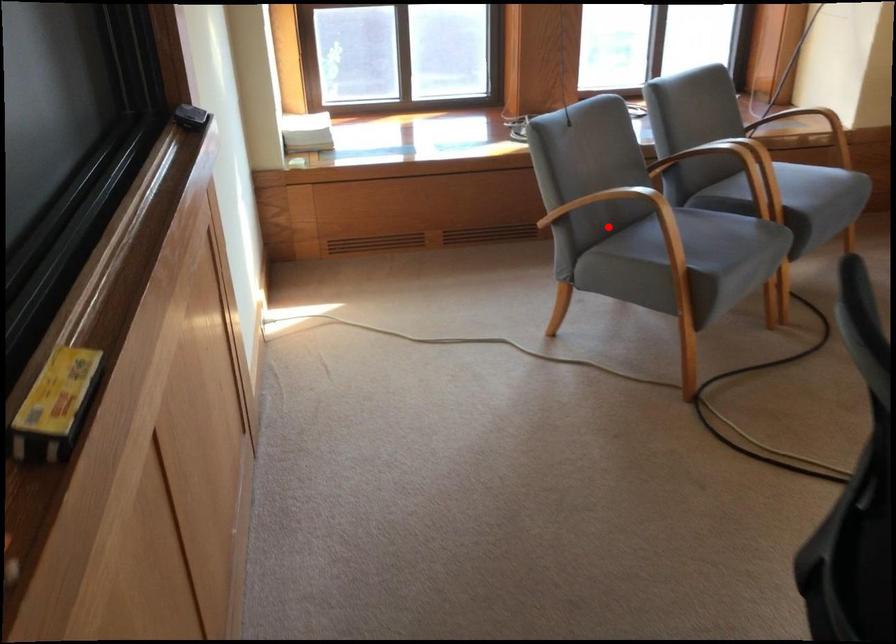
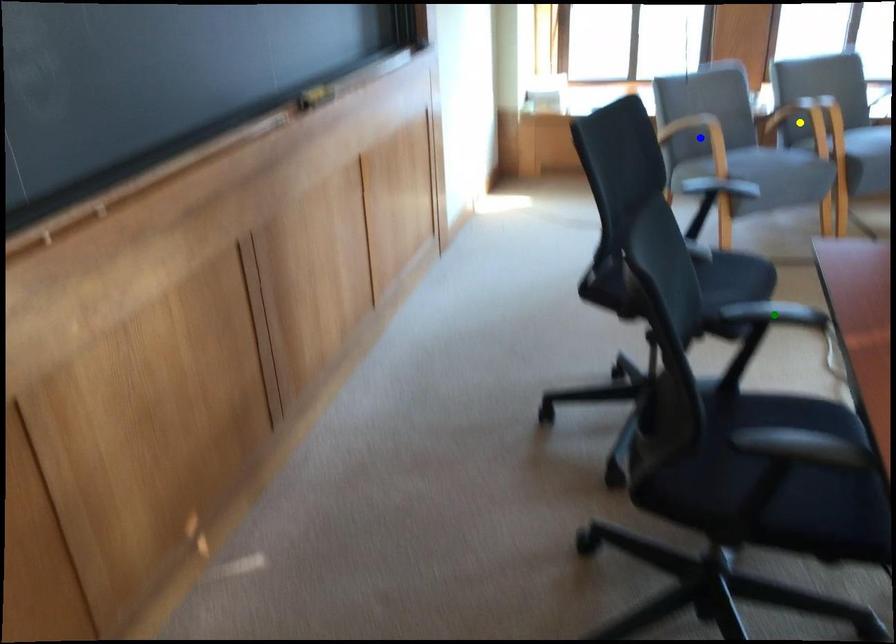
Question: I am providing you with two images of the same scene from different viewpoints. A red point is marked on the first image. You are given multiple points on the second image. In image 2, which mark is for the same physical point as the one in image 1?

Choices:
 (A) green point
 (B) blue point
 (C) yellow point

Answer: (B)